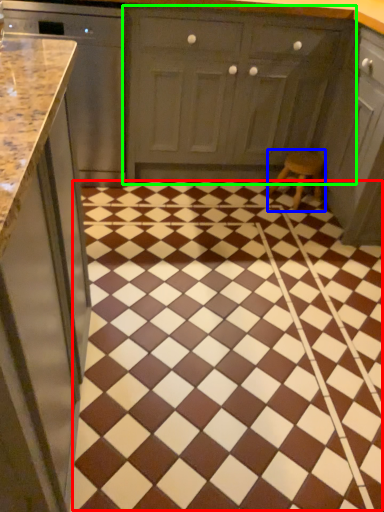
Question: Estimate the real-world distances between objects in this image. Which object is closer to ceramic tile (highlighted by a red box), stool (highlighted by a blue box) or cabinetry (highlighted by a green box)?

Choices:
 (A) stool
 (B) cabinetry

Answer: (A)